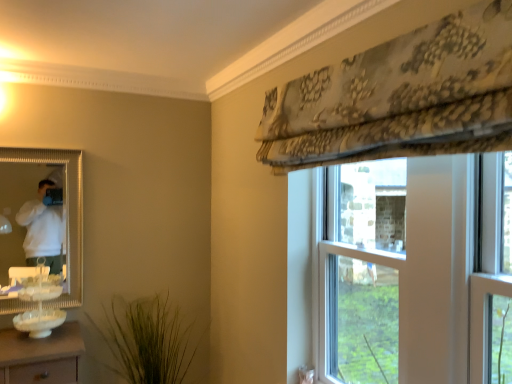
Question: Should I look upward or downward to see green grass-like plant at lower center?

Choices:
 (A) down
 (B) up

Answer: (A)

Question: Is gold-framed mirror at left surrounding white glassware at lower left?

Choices:
 (A) no
 (B) yes

Answer: (A)

Question: Can you confirm if gold-framed mirror at left is wider than white glassware at lower left?

Choices:
 (A) no
 (B) yes

Answer: (A)

Question: Is gold-framed mirror at left outside of white glassware at lower left?

Choices:
 (A) yes
 (B) no

Answer: (A)

Question: From a real-world perspective, is gold-framed mirror at left positioned over white glassware at lower left based on gravity?

Choices:
 (A) yes
 (B) no

Answer: (A)

Question: Can you confirm if gold-framed mirror at left is shorter than white glassware at lower left?

Choices:
 (A) no
 (B) yes

Answer: (A)

Question: Is gold-framed mirror at left thinner than white glassware at lower left?

Choices:
 (A) yes
 (B) no

Answer: (A)

Question: Does clear glass window at center have a larger size compared to gold-framed mirror at left?

Choices:
 (A) yes
 (B) no

Answer: (A)

Question: Considering the relative sizes of clear glass window at center and gold-framed mirror at left in the image provided, is clear glass window at center thinner than gold-framed mirror at left?

Choices:
 (A) no
 (B) yes

Answer: (B)

Question: Is clear glass window at center shorter than gold-framed mirror at left?

Choices:
 (A) yes
 (B) no

Answer: (B)

Question: Is clear glass window at center further to camera compared to gold-framed mirror at left?

Choices:
 (A) no
 (B) yes

Answer: (A)

Question: Is clear glass window at center at the left side of gold-framed mirror at left?

Choices:
 (A) no
 (B) yes

Answer: (A)

Question: Are clear glass window at center and gold-framed mirror at left located far from each other?

Choices:
 (A) no
 (B) yes

Answer: (B)

Question: Is gold-framed mirror at left further to camera compared to clear glass window at center?

Choices:
 (A) yes
 (B) no

Answer: (A)